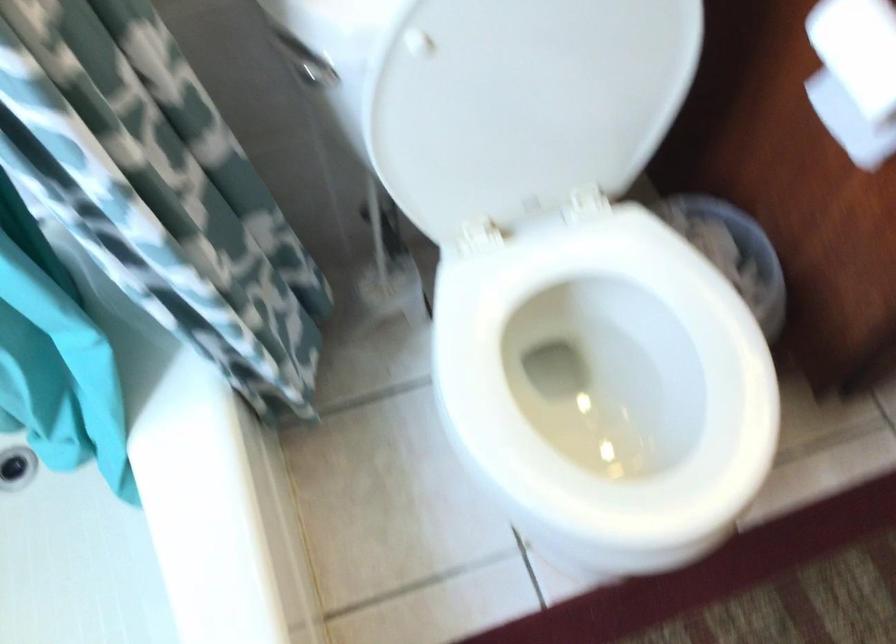
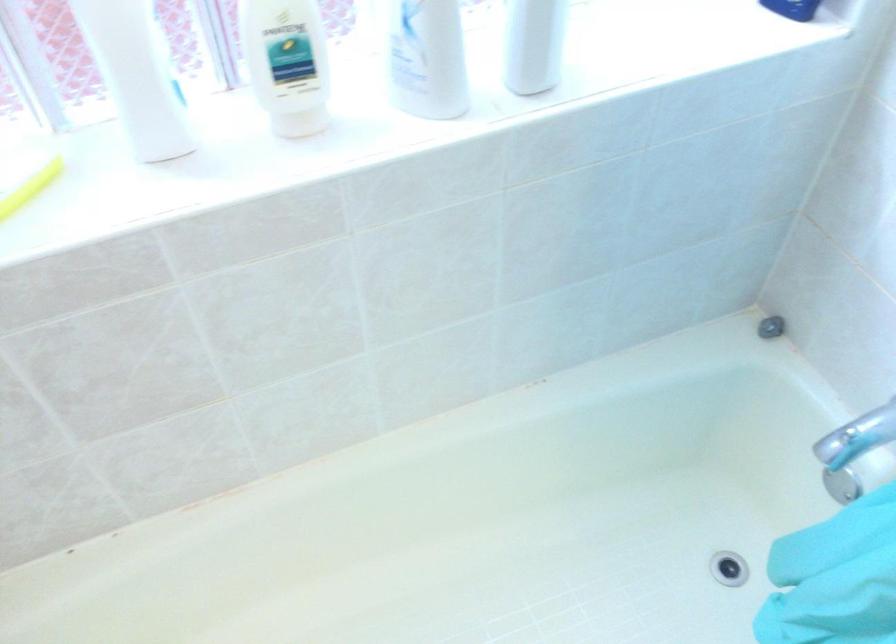
The images are taken continuously from a first-person perspective. In which direction is your viewpoint rotating?

The rotation direction of the camera is left-down.